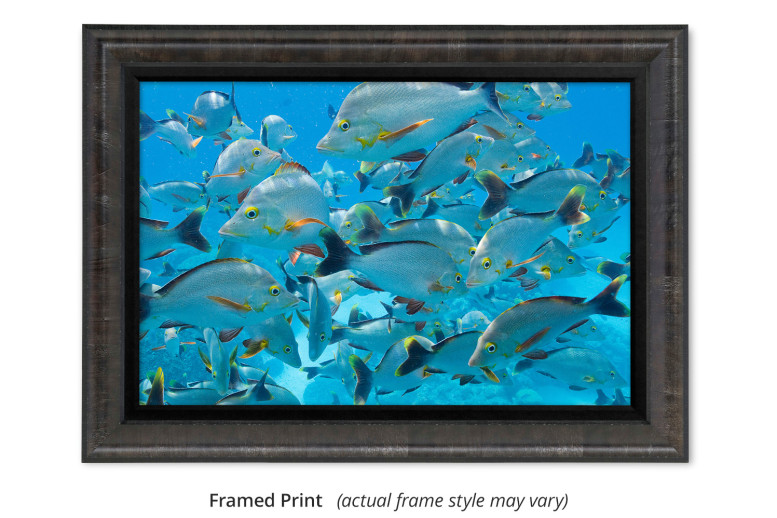
Find the location of a particular element. artwork is located at coordinates (399, 181).